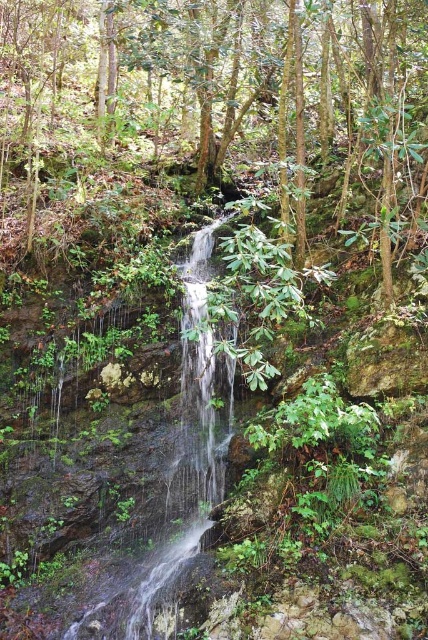
You are a hiker who wants to cross the clear water at center. There is a green leafy tree at center nearby. Can you use the tree to help you cross the water safely?

The green leafy tree at center is located above the clear water at center, so you can use it to anchor a rope or hold on to while crossing the water safely.

You are a hiker who wants to take a photo of the clear water at center without the green leafy tree at center blocking the view. Is it possible to do so by moving closer to the water?

The green leafy tree at center is much taller than clear water at center, so moving closer to the water might still leave the tree visible in the background. However, since the tree is taller, getting closer could potentially frame the shot to exclude the tree if positioned correctly.

You are standing in the forest and want to walk from the point at coordinates point (x=29, y=122) to the point at coordinates point (x=121, y=396). Which direction should you move to get closer to your destination?

Since point (x=29, y=122) is further to the viewer than point (x=121, y=396), you should move forward towards the direction of the waterfall to reach your destination.